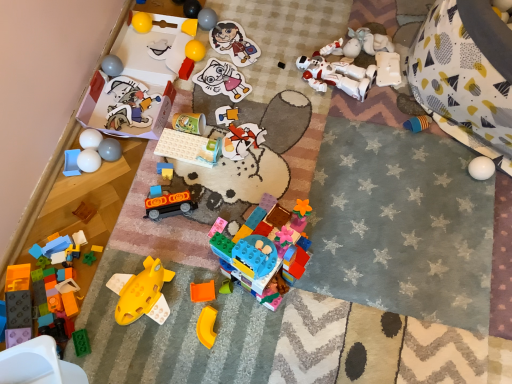
The width and height of the screenshot is (512, 384). Find the location of `free area in between matte plastic blocks at center, the 9th toy viewed from the left, and white plastic robot at upper right, which appears as the second toy when viewed from the right`. free area in between matte plastic blocks at center, the 9th toy viewed from the left, and white plastic robot at upper right, which appears as the second toy when viewed from the right is located at coordinates (273, 127).